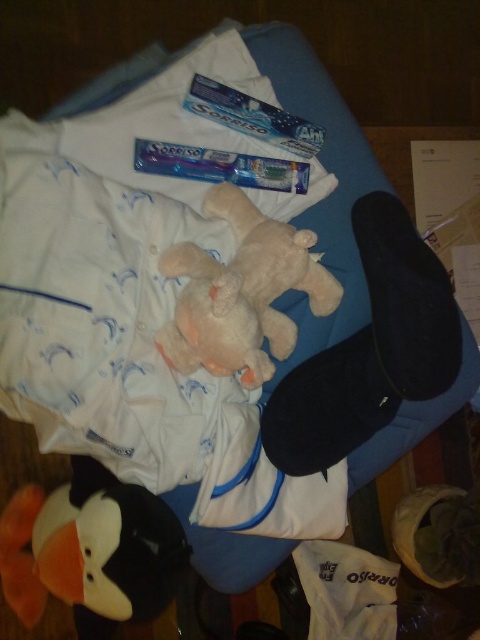
Question: Is fluffy plush penguin at lower left bigger than fluffy pink stuffed animal at center?

Choices:
 (A) no
 (B) yes

Answer: (B)

Question: Which object is farther from the camera taking this photo?

Choices:
 (A) fluffy plush penguin at lower left
 (B) blue glossy toothpaste at upper center

Answer: (B)

Question: Which point is farther from the camera taking this photo?

Choices:
 (A) (240, 228)
 (B) (96, 474)
 (C) (289, 172)

Answer: (B)

Question: Can you confirm if fluffy plush penguin at lower left is positioned below fluffy pink stuffed animal at center?

Choices:
 (A) yes
 (B) no

Answer: (A)

Question: Does fluffy pink stuffed animal at center have a lesser width compared to blue glossy toothpaste at upper center?

Choices:
 (A) yes
 (B) no

Answer: (B)

Question: Considering the real-world distances, which object is farthest from the blue glossy toothpaste at center?

Choices:
 (A) fluffy plush penguin at lower left
 (B) fluffy pink stuffed animal at center
 (C) blue glossy toothpaste at upper center

Answer: (A)